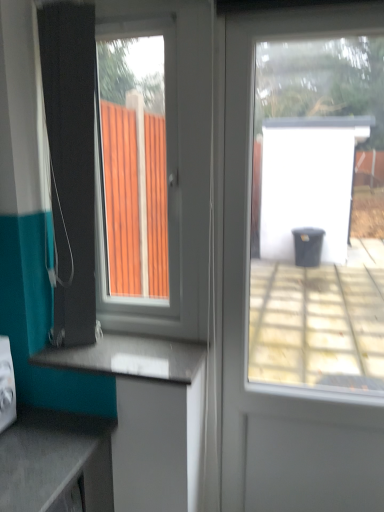
Question: From a real-world perspective, is transparent glass door at center above or below smooth gray countertop at lower center?

Choices:
 (A) above
 (B) below

Answer: (A)

Question: Choose the correct answer: Is transparent glass door at center inside smooth gray countertop at lower center or outside it?

Choices:
 (A) inside
 (B) outside

Answer: (B)

Question: Which object is the closest to the transparent glass door at center?

Choices:
 (A) teal fabric shower curtain at left
 (B) white plastic window at left
 (C) smooth gray countertop at lower center

Answer: (B)

Question: Which object is the closest to the teal fabric shower curtain at left?

Choices:
 (A) smooth gray countertop at lower center
 (B) transparent glass door at center
 (C) white plastic window at left

Answer: (C)